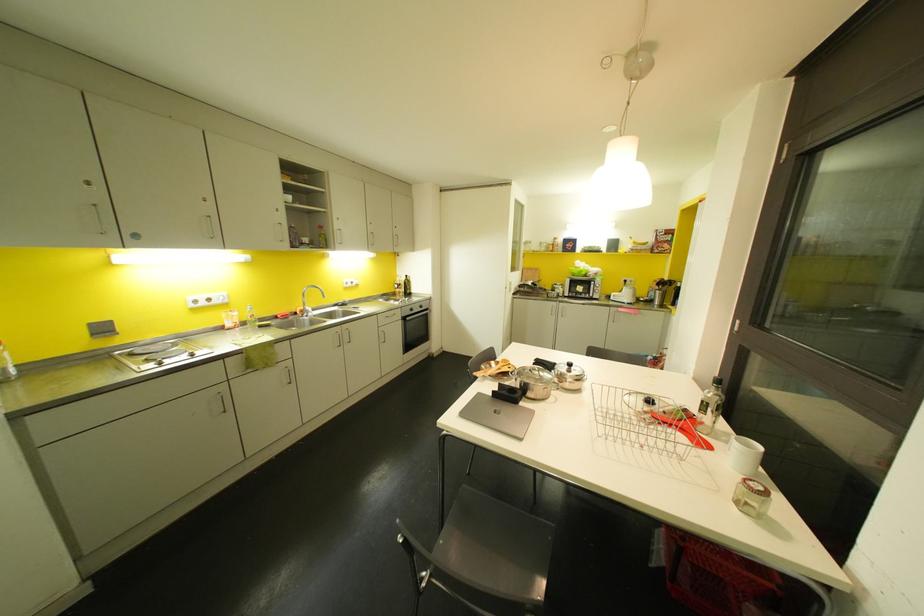
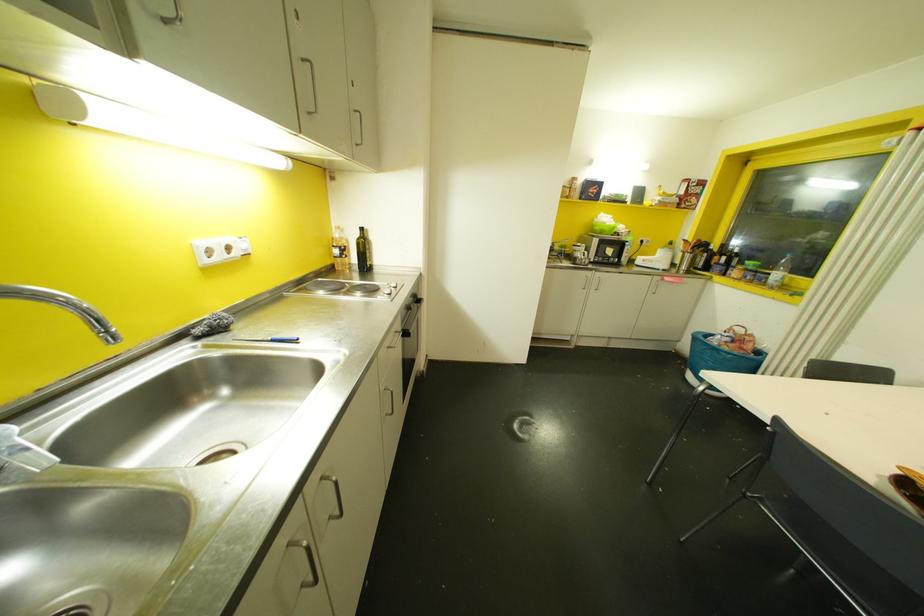
The images are taken continuously from a first-person perspective. In which direction are you moving?

The cameraman moved toward left, forward.